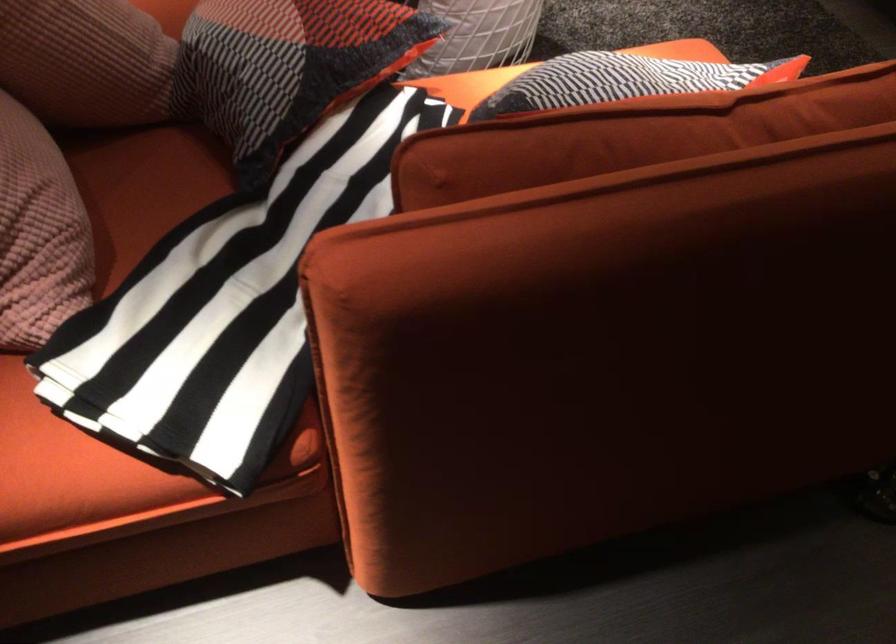
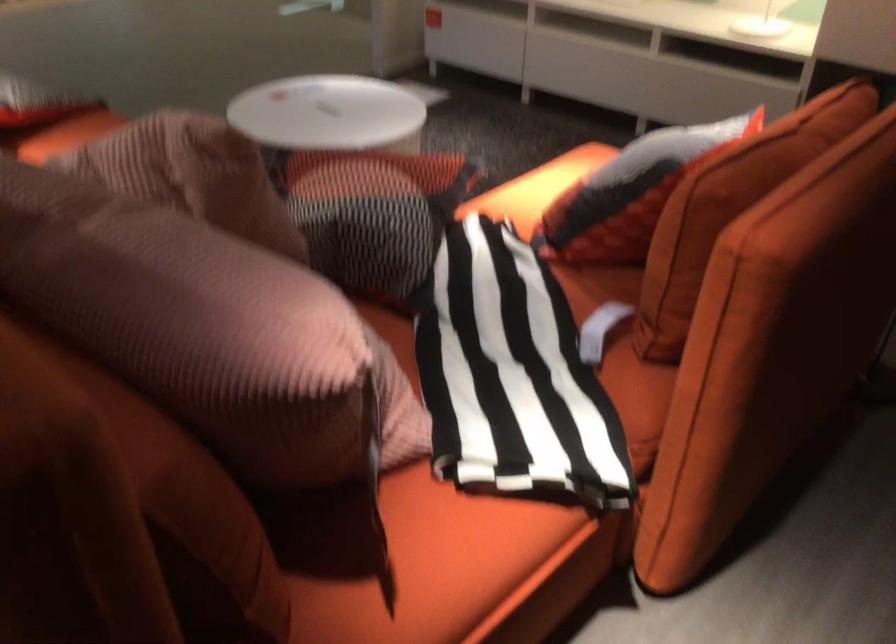
Where in the second image is the point corresponding to point 231,298 from the first image?

(512, 375)